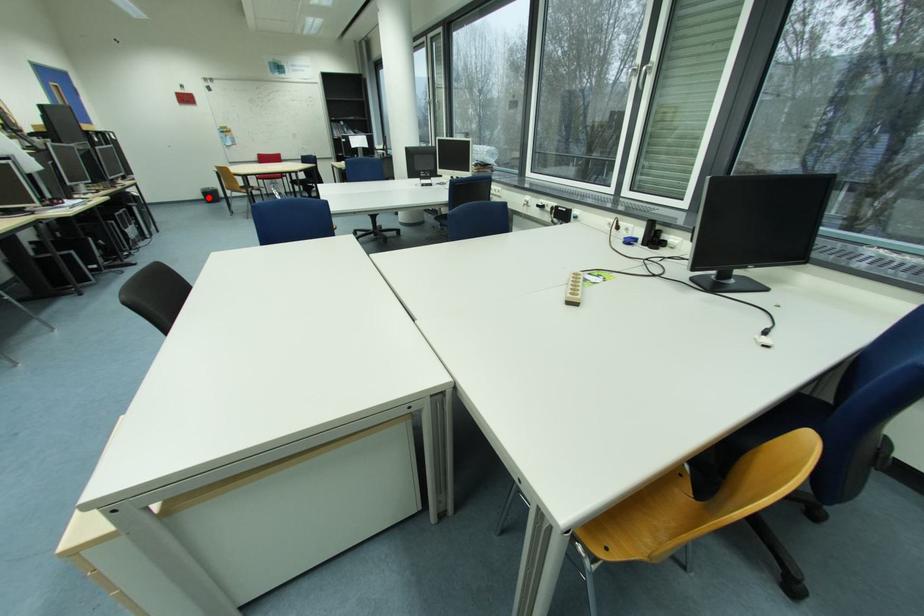
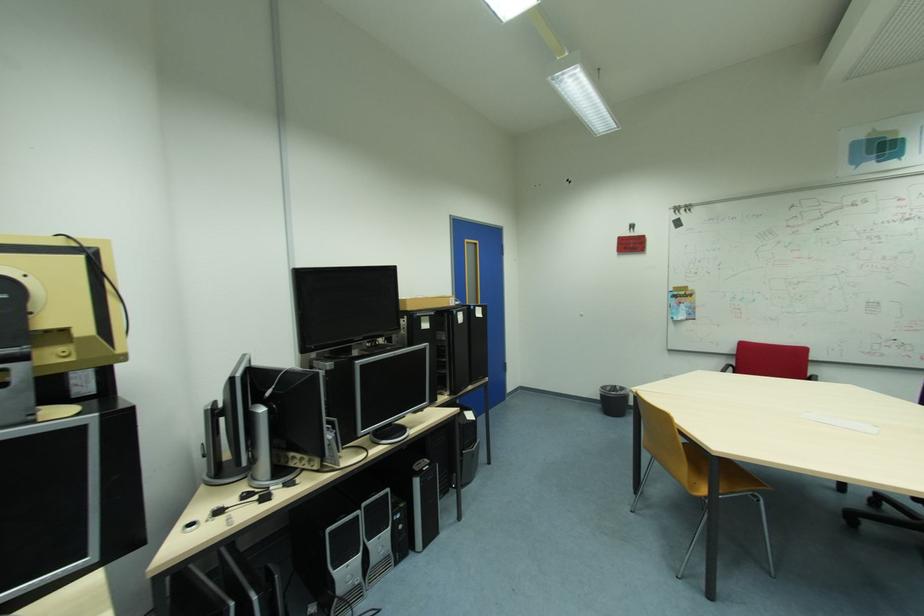
Question: A red point is marked in image1. In image2, is the corresponding 3D point closer to the camera or farther? Reply with the corresponding letter.

Choices:
 (A) The corresponding 3D point is closer.
 (B) The corresponding 3D point is farther.

Answer: (B)